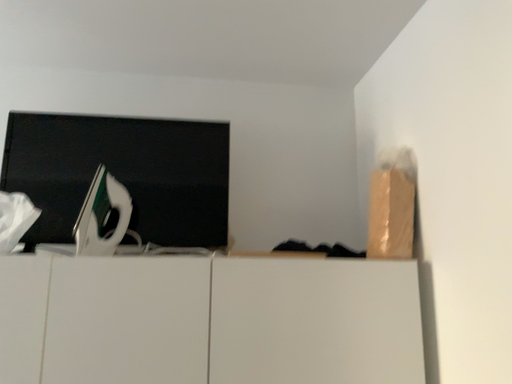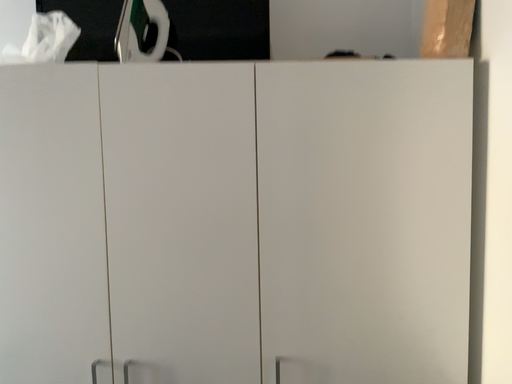
Question: How did the camera likely rotate when shooting the video?

Choices:
 (A) rotated downward
 (B) rotated upward

Answer: (A)